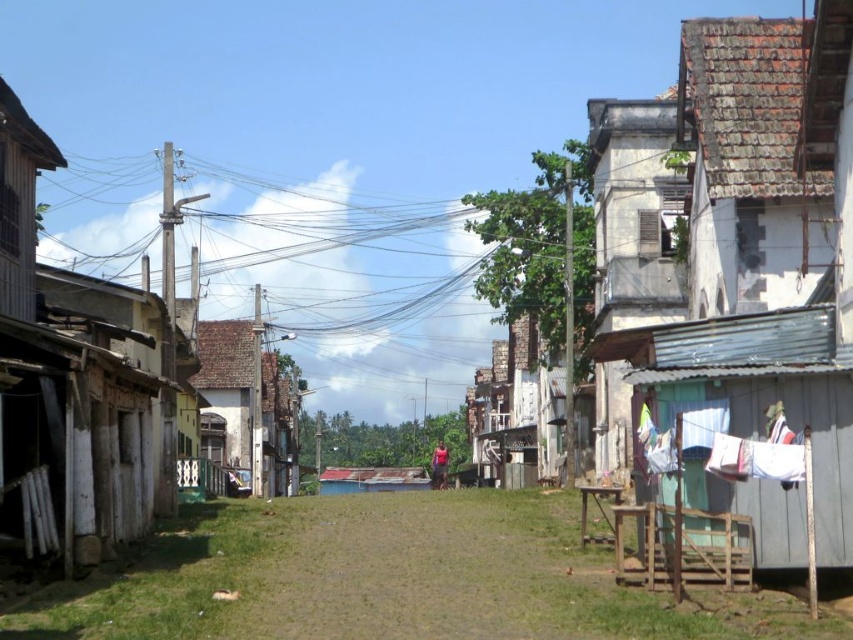
You are a delivery person with a cart that is 2 meters wide. You need to navigate through the narrow street and pass between the rusty corrugated metal hut at right and the white fabric at right. Is there enough space for your cart to fit through?

The distance between the rusty corrugated metal hut at right and the white fabric at right is 3.91 meters. Since your cart is 2 meters wide, there is sufficient space for it to pass through the gap between them.